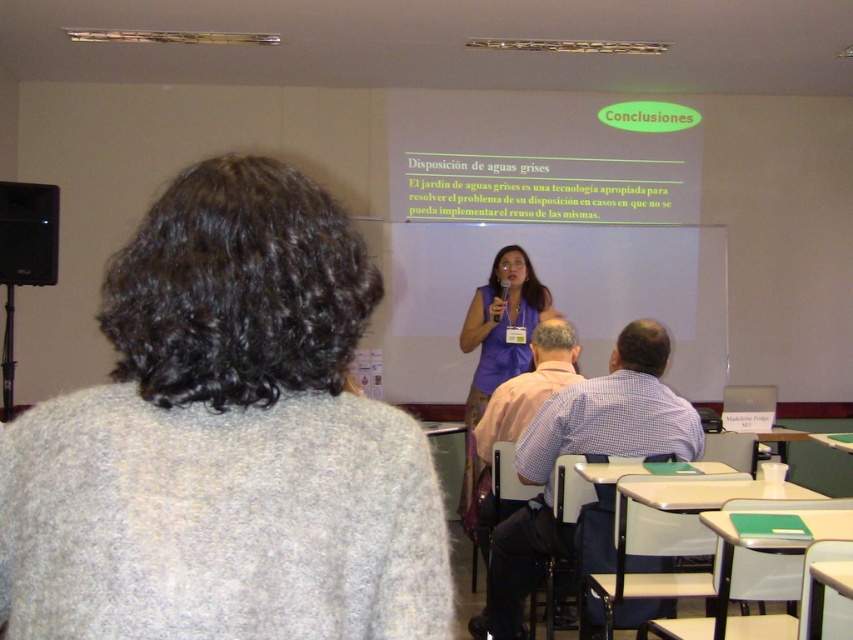
Question: Which point is closer to the camera taking this photo?

Choices:
 (A) (643, 416)
 (B) (3, 200)

Answer: (A)

Question: Which of these objects is positioned closest to the gray woolen sweater at upper left?

Choices:
 (A) purple fabric dress at center
 (B) checkered fabric shirt at center

Answer: (B)

Question: Which object is the farthest from the black matte speaker at left?

Choices:
 (A) checkered fabric shirt at center
 (B) gray woolen sweater at upper left

Answer: (B)

Question: Is purple fabric dress at center thinner than black matte speaker at left?

Choices:
 (A) yes
 (B) no

Answer: (B)

Question: Can you confirm if gray woolen sweater at upper left is positioned below black matte speaker at left?

Choices:
 (A) no
 (B) yes

Answer: (B)

Question: Is checkered fabric shirt at center in front of black matte speaker at left?

Choices:
 (A) no
 (B) yes

Answer: (B)